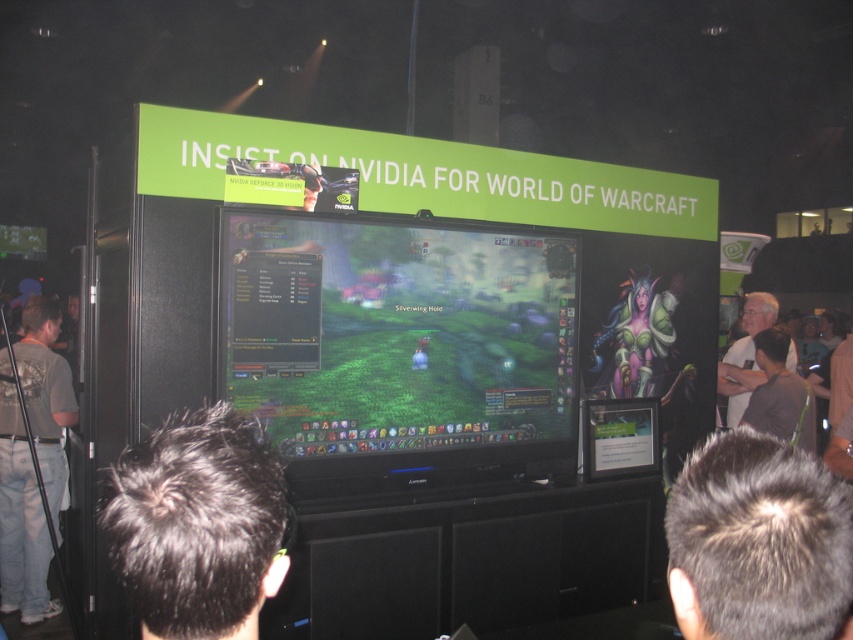
You are a photographer at the event and want to take a photo of the shiny black monitor at center and the dark hair at center. Which object should you focus on first if you want to capture both in sharp focus?

The shiny black monitor at center is wider than dark hair at center, so you should focus on the shiny black monitor at center first to ensure both are in sharp focus.

You are attending a gaming convention and notice the shiny black monitor at center and dark hair at center in the booth. Which object is positioned higher in the scene?

The shiny black monitor at center is located above the dark hair at center, so it is positioned higher.